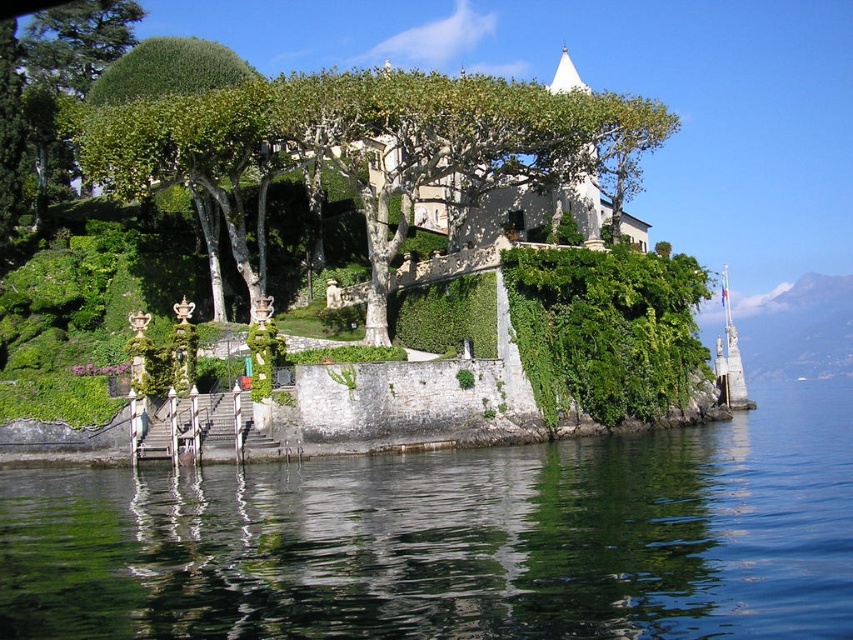
You are a visitor standing at the stone walkway and see the green leafy tree at upper center and the green leafy tree at upper left. Which tree is closer to your right side?

The green leafy tree at upper center is positioned on the right side of green leafy tree at upper left, so the green leafy tree at upper center is closer to your right side.

You are standing at the water edge and want to take a photo of the green leafy tree at upper center. To ensure the tree is centered in your photo, where should you aim your camera? Please provide the coordinates in the format of a point like this example format, e.g., point at point 0.228, 0.441. The scene is described as follows...

The green leafy tree at upper center is located at point (375, 145), so you should aim your camera at that coordinate to center the tree in your photo.